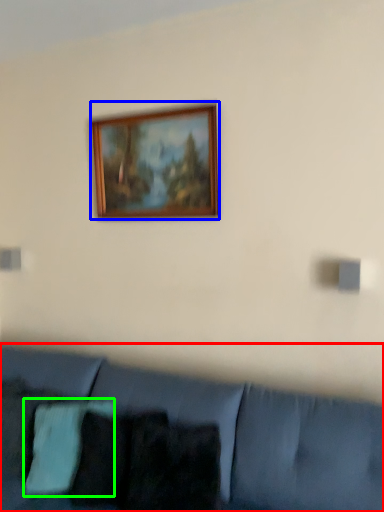
Question: Considering the real-world distances, which object is closest to studio couch (highlighted by a red box)? picture frame (highlighted by a blue box) or pillow (highlighted by a green box).

Choices:
 (A) picture frame
 (B) pillow

Answer: (B)